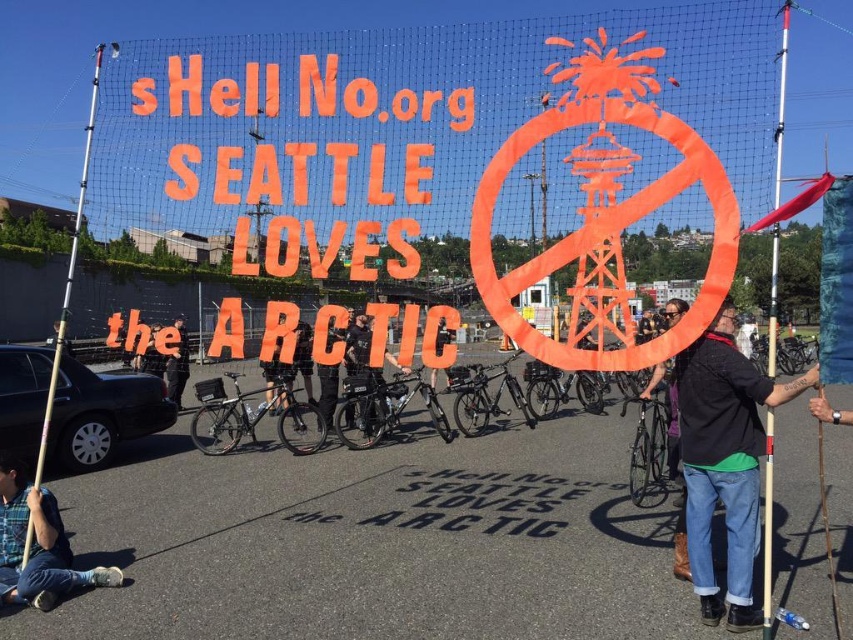
You are a photographer standing at the scene of the protest. You need to position yourself so that the silver metallic pole at left and the dark blue jeans at center are both in your shot. Based on their positions, which object should you place closer to the left side of your camera frame?

The silver metallic pole at left is to the left of the dark blue jeans at center, so you should place the silver metallic pole at left closer to the left side of your camera frame.

You are a photographer trying to capture the banner in the center of the protest scene. You notice a person wearing a blue plaid shirt at lower left and another wearing dark blue jeans at center. Which clothing item is shorter in height?

The blue plaid shirt at lower left has a lesser height compared to dark blue jeans at center, so the blue plaid shirt at lower left is shorter in height.